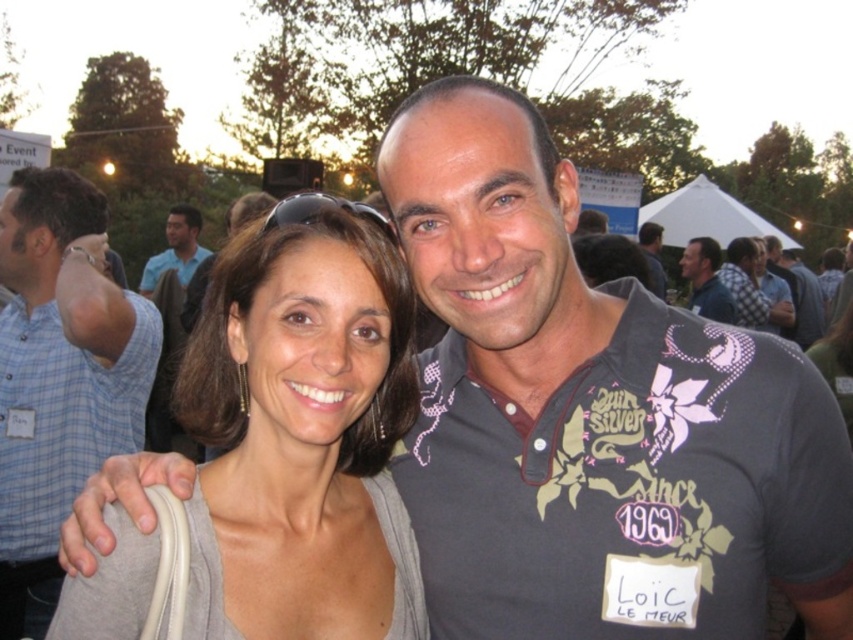
Can you confirm if gray fabric at center is thinner than dark blue shirt at center?

No.

From the picture: Does gray fabric at center appear over dark blue shirt at center?

Actually, gray fabric at center is below dark blue shirt at center.

Measure the distance between gray fabric at center and camera.

gray fabric at center is 1.14 meters away from camera.

This screenshot has height=640, width=853. I want to click on gray fabric at center, so click(282, 449).

Based on the photo, between matte gray sweater at center and blue shirt at upper left, which one is positioned higher?

blue shirt at upper left is higher up.

What do you see at coordinates (750, 289) in the screenshot?
I see `matte gray sweater at center` at bounding box center [750, 289].

What are the coordinates of `matte gray sweater at center` in the screenshot? It's located at (750, 289).

In order to click on blue plaid shirt at left in this screenshot , I will do `click(59, 378)`.

Is point (74, 456) farther from camera compared to point (737, 244)?

No, it is not.

Identify the location of blue plaid shirt at left. The width and height of the screenshot is (853, 640). (59, 378).